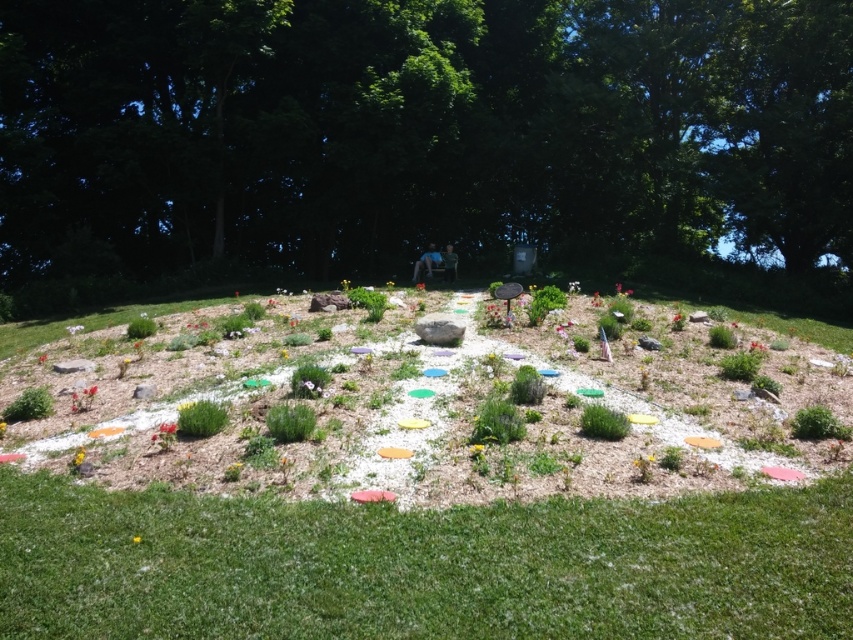
You are standing at the starting point of the garden pathway and see a green leafy tree at center. Can you tell me what is located at the coordinate point (416, 131)?

The point (416, 131) is on the green leafy tree at center.

You are standing at the entrance of the garden and see the green leafy tree at center. If you walk straight ahead, will you reach the tree before the pathway ends?

The green leafy tree at center is located at point 0.205 on the x and 0.490 on the y axis. Since the tree is positioned at the center of the garden, walking straight ahead from the entrance should lead you directly towards it before the pathway ends.

You are standing at the edge of the garden and want to walk towards the green grass at lower center. Which direction should you head in relation to the green leafy tree at center?

You should head to the left of the green leafy tree at center because the green grass at lower center is located to the right of the tree.